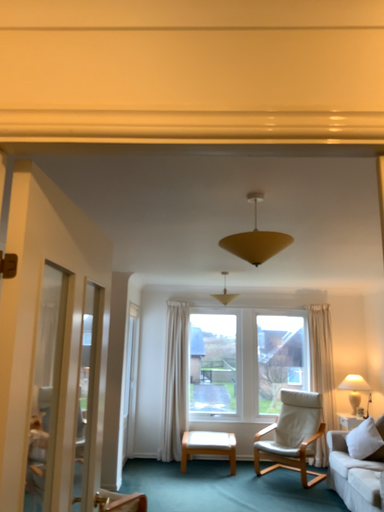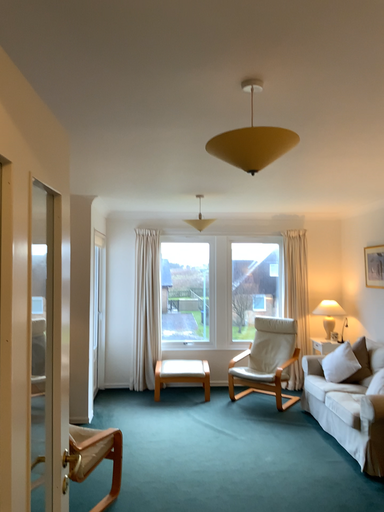
Question: Which way did the camera rotate in the video?

Choices:
 (A) rotated upward
 (B) rotated downward

Answer: (B)